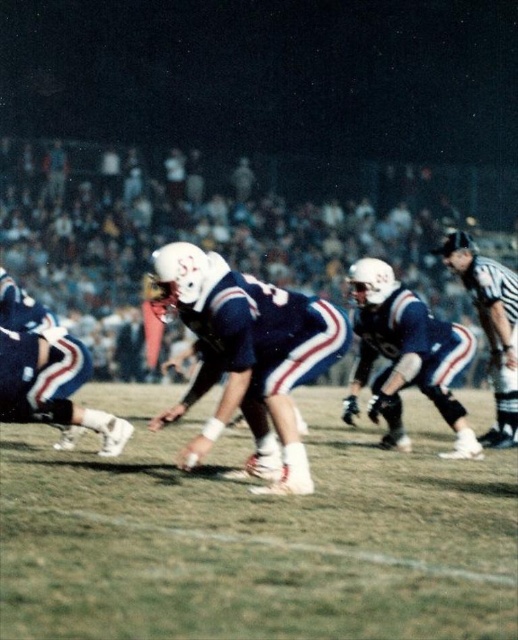
Question: Is green grass at center below black uniformed figure at right?

Choices:
 (A) yes
 (B) no

Answer: (A)

Question: Considering the real-world distances, which object is closest to the green grass at center?

Choices:
 (A) blue fabric uniform at center
 (B) black uniformed figure at right

Answer: (B)

Question: Which point appears closest to the camera in this image?

Choices:
 (A) (194, 532)
 (B) (50, 403)
 (C) (462, 243)

Answer: (A)

Question: Based on their relative distances, which object is nearer to the black uniformed figure at right?

Choices:
 (A) blue fabric uniform at center
 (B) green grass at center

Answer: (A)

Question: Is green grass at center positioned in front of black uniformed figure at right?

Choices:
 (A) yes
 (B) no

Answer: (A)

Question: Is blue fabric uniform at center further to the viewer compared to black uniformed figure at right?

Choices:
 (A) yes
 (B) no

Answer: (B)